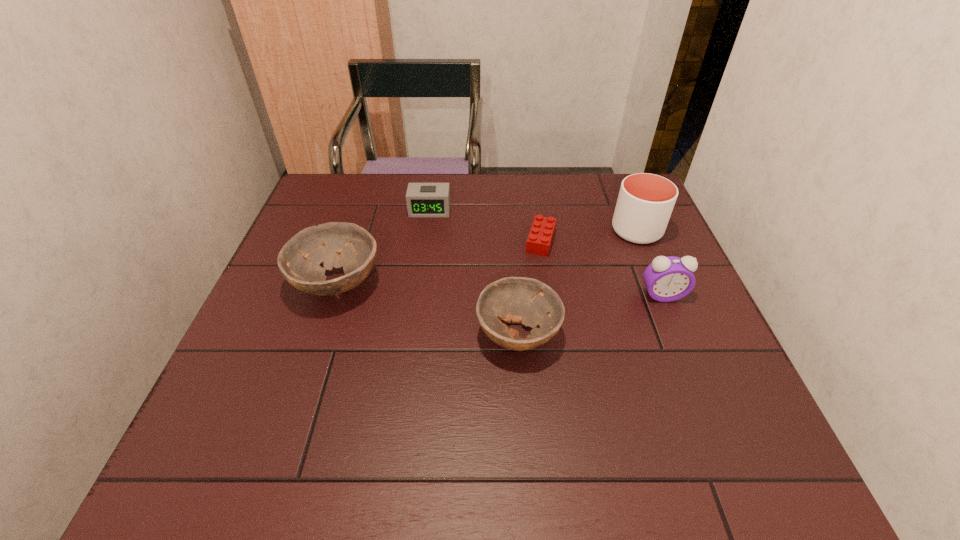
In the current image, all bowls are evenly spaced. To maintain this equal spacing, where should an additional bowl be placed on the right? Please point out a free spot. Please provide its 2D coordinates. Your answer should be formatted as a tuple, i.e. [(x, y)], where the tuple contains the x and y coordinates of a point satisfying the conditions above.

[(746, 398)]